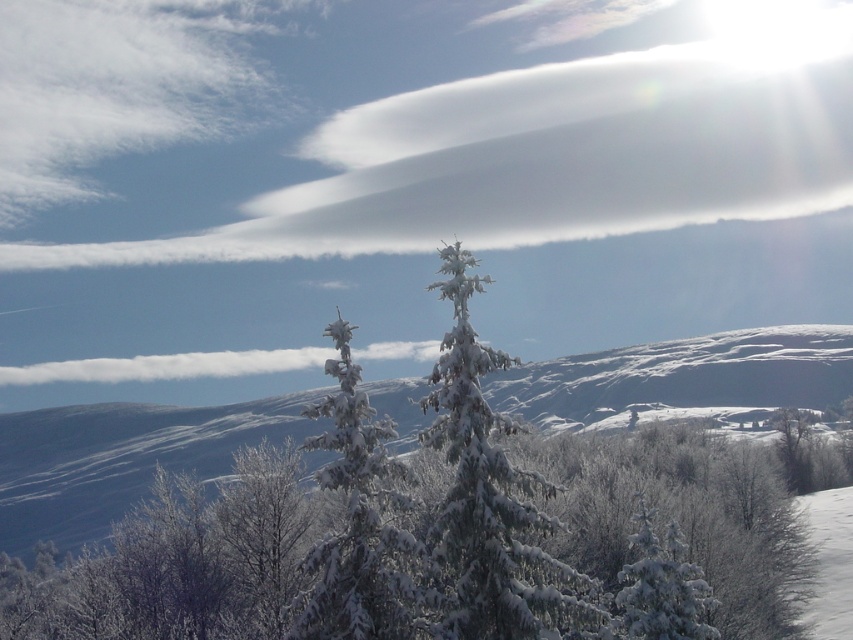
Question: From the image, what is the correct spatial relationship of white fluffy cloud at upper center in relation to snow-covered evergreen at center?

Choices:
 (A) right
 (B) left

Answer: (A)

Question: Which object appears closest to the camera in this image?

Choices:
 (A) white fluffy cloud at upper center
 (B) white frosty tree at center

Answer: (B)

Question: Among these objects, which one is nearest to the camera?

Choices:
 (A) white frosty tree at center
 (B) snow-covered evergreen at center
 (C) white fluffy cloud at upper center

Answer: (A)

Question: Which point appears farthest from the camera in this image?

Choices:
 (A) (709, 58)
 (B) (494, 528)
 (C) (305, 566)

Answer: (A)

Question: Can you confirm if snow-covered evergreen at center is positioned below white frosty tree at center?

Choices:
 (A) yes
 (B) no

Answer: (B)

Question: Can you confirm if white fluffy cloud at upper center is bigger than snow-covered evergreen at center?

Choices:
 (A) no
 (B) yes

Answer: (B)